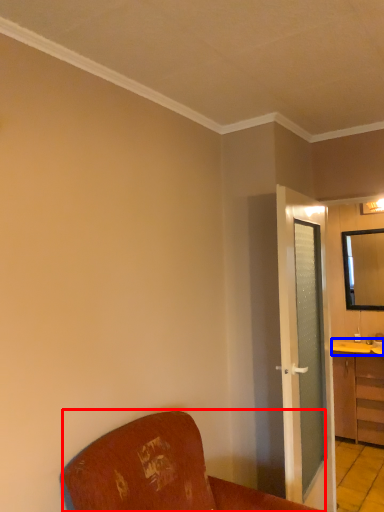
Question: Which of the following is the farthest to the observer, furniture (highlighted by a red box) or counter top (highlighted by a blue box)?

Choices:
 (A) furniture
 (B) counter top

Answer: (B)